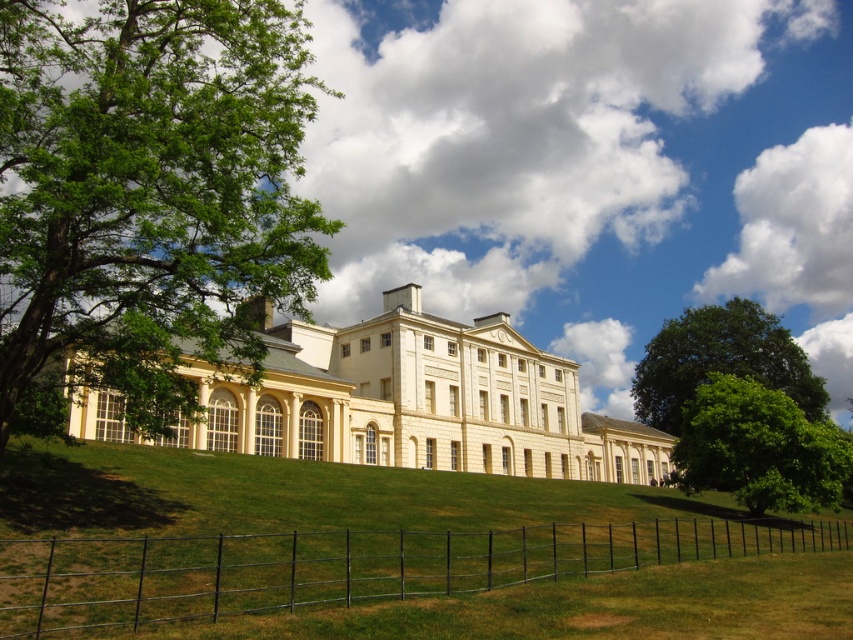
Question: Which point is farther to the camera?

Choices:
 (A) (769, 348)
 (B) (585, 412)

Answer: (B)

Question: Which of the following is the farthest from the observer?

Choices:
 (A) (27, 157)
 (B) (752, 476)
 (C) (775, 342)
 (D) (347, 387)

Answer: (C)

Question: Does matte cream building at center have a greater width compared to green leafy tree at lower right?

Choices:
 (A) yes
 (B) no

Answer: (A)

Question: Can you confirm if green leafy tree at left is positioned below green leafy tree at upper right?

Choices:
 (A) no
 (B) yes

Answer: (A)

Question: In this image, where is matte cream building at center located relative to green leafy tree at upper right?

Choices:
 (A) left
 (B) right

Answer: (A)

Question: Which point is closer to the camera?

Choices:
 (A) matte cream building at center
 (B) green leafy tree at lower right
 (C) green leafy tree at upper right
 (D) green leafy tree at left

Answer: (D)